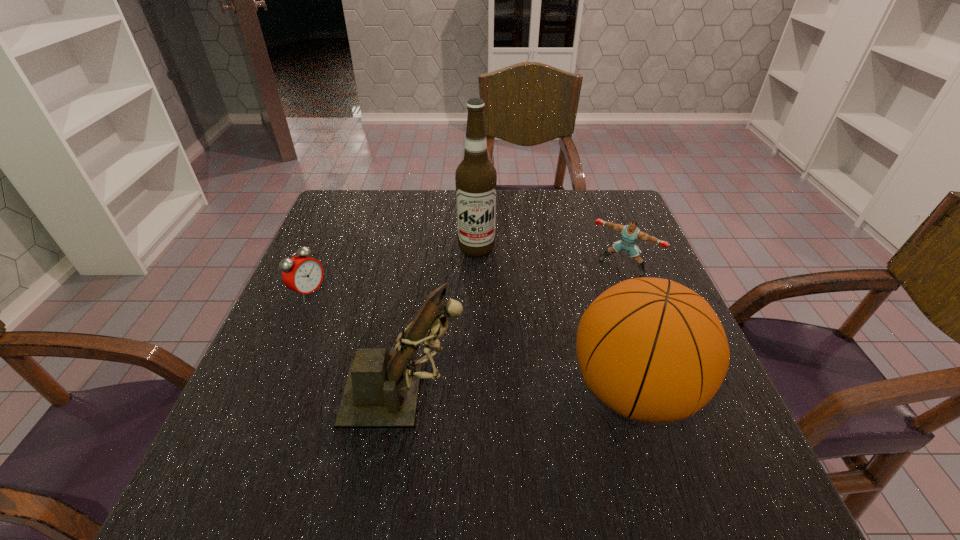
Where is `free space on the desktop that is between the figurine and the basketball and is positioned on the front-facing side of the leftmost object`? free space on the desktop that is between the figurine and the basketball and is positioned on the front-facing side of the leftmost object is located at coordinates (513, 392).

The image size is (960, 540). What are the coordinates of `free space on the desktop that is between the figurine and the basketball and is positioned on the label of the tallest object` in the screenshot? It's located at (486, 392).

Find the location of a particular element. The image size is (960, 540). free space on the desktop that is between the figurine and the basketball and is positioned on the front-facing side of the puncher is located at coordinates (532, 392).